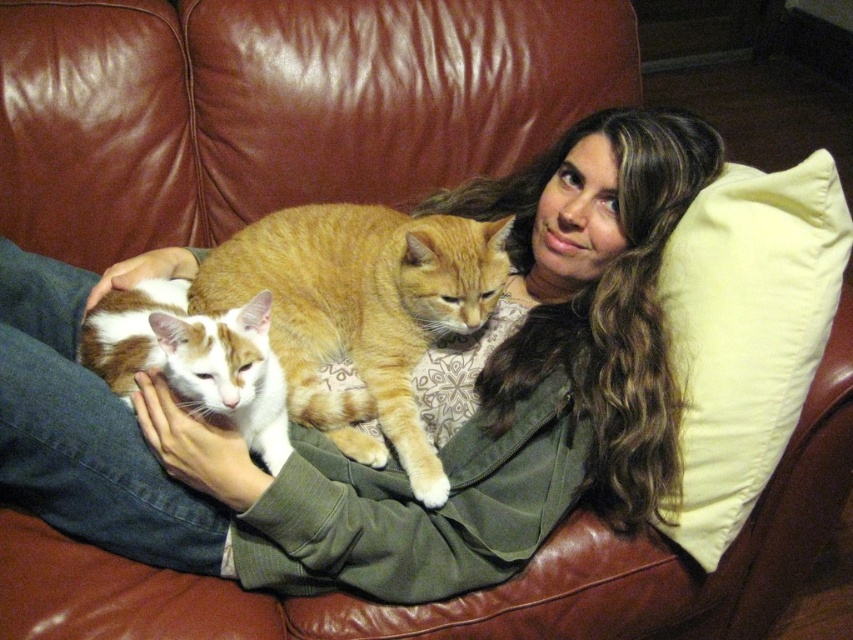
Question: Can you confirm if white fabric pillow at right is bigger than orange tabby cat at center?

Choices:
 (A) yes
 (B) no

Answer: (B)

Question: Can you confirm if orange tabby cat at center is smaller than white and orange fur cat at center?

Choices:
 (A) yes
 (B) no

Answer: (B)

Question: Which point appears closest to the camera in this image?

Choices:
 (A) (764, 195)
 (B) (393, 300)
 (C) (262, 355)

Answer: (C)

Question: Is white fabric pillow at right bigger than white and orange fur cat at center?

Choices:
 (A) no
 (B) yes

Answer: (A)

Question: Which point appears closest to the camera in this image?

Choices:
 (A) (718, 419)
 (B) (206, 346)

Answer: (B)

Question: Which of these objects is positioned closest to the white fabric pillow at right?

Choices:
 (A) white and orange fur cat at center
 (B) orange tabby cat at center

Answer: (B)